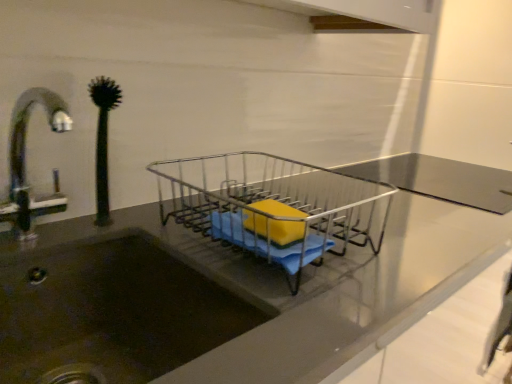
Question: From a real-world perspective, is yellow sponge at center positioned above or below metallic wire dish rack at center?

Choices:
 (A) above
 (B) below

Answer: (A)

Question: Is point (288, 226) positioned closer to the camera than point (267, 256)?

Choices:
 (A) closer
 (B) farther

Answer: (B)

Question: Which of these objects is positioned closest to the yellow sponge at center?

Choices:
 (A) metallic wire dish rack at center
 (B) green rubber plant at left

Answer: (A)

Question: Which object is the farthest from the metallic wire dish rack at center?

Choices:
 (A) yellow sponge at center
 (B) green rubber plant at left

Answer: (B)